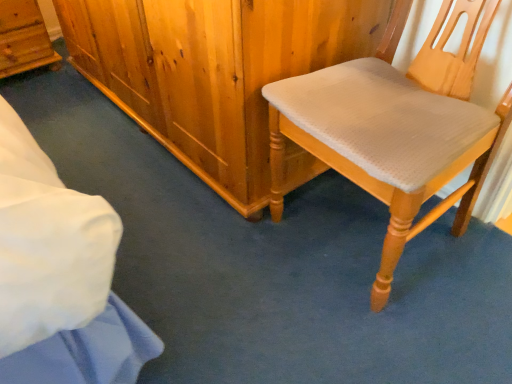
Question: Does point (506, 89) appear closer or farther from the camera than point (2, 64)?

Choices:
 (A) closer
 (B) farther

Answer: (A)

Question: In terms of width, does light wood/texture chair at right look wider or thinner when compared to wooden cabinet at upper left?

Choices:
 (A) thin
 (B) wide

Answer: (B)

Question: Which is correct: light wood/texture chair at right is inside wooden cabinet at upper left, or outside of it?

Choices:
 (A) outside
 (B) inside

Answer: (A)

Question: Considering their positions, is wooden cabinet at upper left located in front of or behind light wood/texture chair at right?

Choices:
 (A) front
 (B) behind

Answer: (B)

Question: Considering the positions of point (30, 61) and point (449, 36), is point (30, 61) closer or farther from the camera than point (449, 36)?

Choices:
 (A) farther
 (B) closer

Answer: (A)

Question: Is wooden cabinet at upper left situated inside light wood/texture chair at right or outside?

Choices:
 (A) outside
 (B) inside

Answer: (A)

Question: From a real-world perspective, is wooden cabinet at upper left physically located above or below light wood/texture chair at right?

Choices:
 (A) above
 (B) below

Answer: (B)